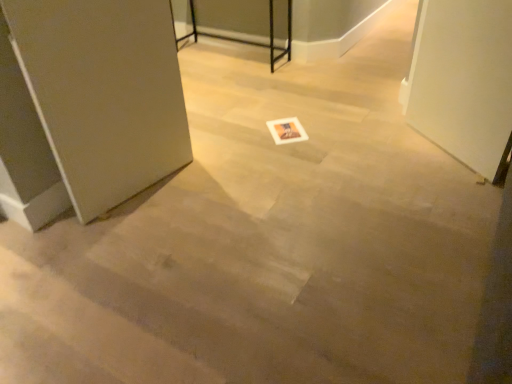
Question: Does satin silver door at left appear on the left side of white glossy screen door at right?

Choices:
 (A) yes
 (B) no

Answer: (A)

Question: From the image's perspective, is satin silver door at left located beneath white glossy screen door at right?

Choices:
 (A) no
 (B) yes

Answer: (B)

Question: Is satin silver door at left further to camera compared to white glossy screen door at right?

Choices:
 (A) yes
 (B) no

Answer: (B)

Question: Does satin silver door at left have a smaller size compared to white glossy screen door at right?

Choices:
 (A) yes
 (B) no

Answer: (A)

Question: Is satin silver door at left surrounding white glossy screen door at right?

Choices:
 (A) no
 (B) yes

Answer: (A)

Question: Looking at their shapes, would you say metallic black table at upper center is wider or thinner than white glossy screen door at right?

Choices:
 (A) thin
 (B) wide

Answer: (B)

Question: Visually, is metallic black table at upper center positioned to the left or to the right of white glossy screen door at right?

Choices:
 (A) left
 (B) right

Answer: (A)

Question: Relative to white glossy screen door at right, is metallic black table at upper center in front or behind?

Choices:
 (A) front
 (B) behind

Answer: (B)

Question: Looking at the image, does metallic black table at upper center seem bigger or smaller compared to white glossy screen door at right?

Choices:
 (A) big
 (B) small

Answer: (A)

Question: From the image's perspective, is white glossy screen door at right above or below satin silver door at left?

Choices:
 (A) below
 (B) above

Answer: (B)

Question: Is white glossy screen door at right bigger or smaller than satin silver door at left?

Choices:
 (A) big
 (B) small

Answer: (A)

Question: Is point (450, 67) closer or farther from the camera than point (133, 92)?

Choices:
 (A) farther
 (B) closer

Answer: (A)

Question: In the image, is white glossy screen door at right positioned in front of or behind satin silver door at left?

Choices:
 (A) behind
 (B) front

Answer: (A)

Question: Considering the positions of metallic black table at upper center and white paper postcard at center in the image, is metallic black table at upper center taller or shorter than white paper postcard at center?

Choices:
 (A) tall
 (B) short

Answer: (A)

Question: Considering their positions, is metallic black table at upper center located in front of or behind white paper postcard at center?

Choices:
 (A) front
 (B) behind

Answer: (B)